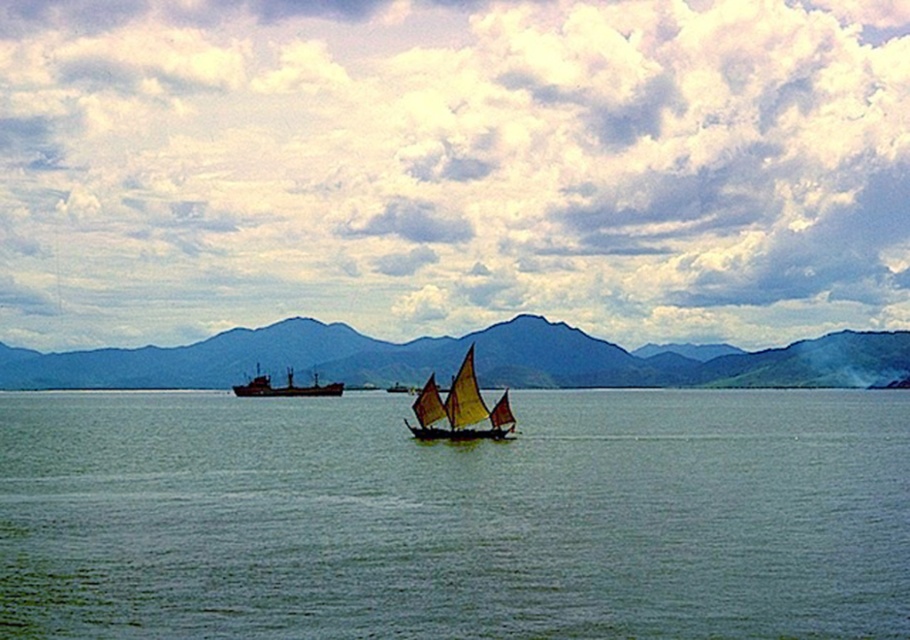
Is dark blue mountain at center positioned before yellow fabric sailboat at center?

That is False.

Looking at this image, who is positioned more to the right, dark blue mountain at center or yellow fabric sailboat at center?

From the viewer's perspective, yellow fabric sailboat at center appears more on the right side.

Image resolution: width=910 pixels, height=640 pixels. What do you see at coordinates (458, 358) in the screenshot? I see `dark blue mountain at center` at bounding box center [458, 358].

Identify the location of dark blue mountain at center. The height and width of the screenshot is (640, 910). (458, 358).

Who is shorter, yellow fabric sailboat at center or dark gray matte cargo ship at center?

yellow fabric sailboat at center is shorter.

Looking at this image, can you confirm if yellow fabric sailboat at center is positioned above dark gray matte cargo ship at center?

Yes.

You are a GUI agent. You are given a task and a screenshot of the screen. Output one action in this format:
    pyautogui.click(x=<x>, y=<y>)
    Task: Click on the yellow fabric sailboat at center
    The image size is (910, 640).
    Given the screenshot: What is the action you would take?
    [459, 408]

Locate an element on the screen. This screenshot has height=640, width=910. yellow fabric sailboat at center is located at coordinates tap(459, 408).

Is point (206, 376) closer to viewer compared to point (310, 396)?

No, (206, 376) is behind (310, 396).

Can you confirm if dark blue mountain at center is taller than dark gray matte cargo ship at center?

Yes, dark blue mountain at center is taller than dark gray matte cargo ship at center.

Image resolution: width=910 pixels, height=640 pixels. Find the location of `dark blue mountain at center`. dark blue mountain at center is located at coordinates (458, 358).